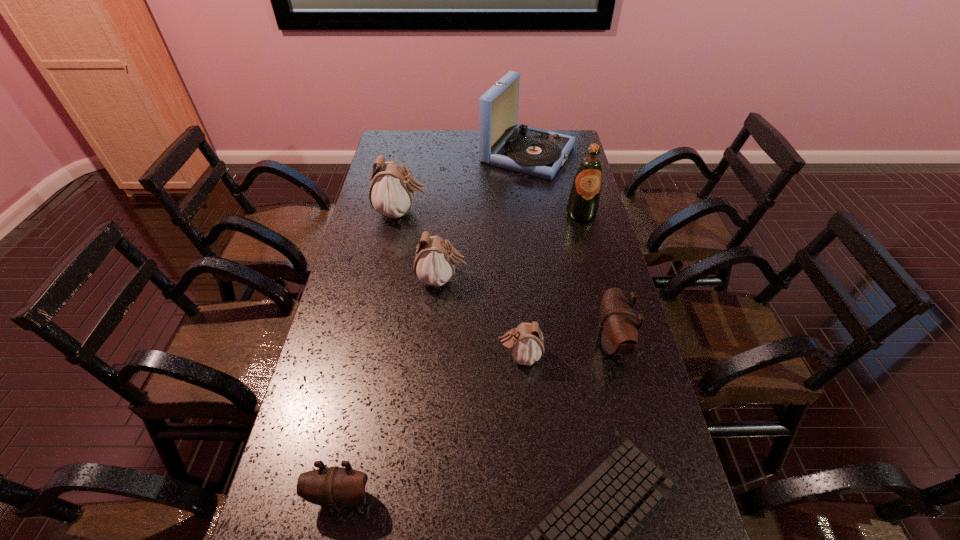
Find the location of `blue phonograph record`. blue phonograph record is located at coordinates (502, 142).

Identify the location of the farthest object. The width and height of the screenshot is (960, 540). (502, 142).

This screenshot has width=960, height=540. Identify the location of green olive oil. (583, 203).

Where is `the biggest white pouch`? The image size is (960, 540). the biggest white pouch is located at coordinates (391, 193).

Identify the location of the tallest pouch. Image resolution: width=960 pixels, height=540 pixels. (391, 193).

Where is `the second farthest white pouch`? The width and height of the screenshot is (960, 540). the second farthest white pouch is located at coordinates (434, 264).

Locate an element on the screen. The image size is (960, 540). the fifth nearest object is located at coordinates (434, 264).

Identify the location of the rightmost pouch. The width and height of the screenshot is (960, 540). (618, 331).

You are a GUI agent. You are given a task and a screenshot of the screen. Output one action in this format:
    pyautogui.click(x=<x>, y=<y>)
    Task: Click on the farther brown pouch
    This screenshot has height=540, width=960.
    Given the screenshot: What is the action you would take?
    pyautogui.click(x=618, y=331)

The image size is (960, 540). What are the coordinates of `the second pouch from right to left` in the screenshot? It's located at (525, 343).